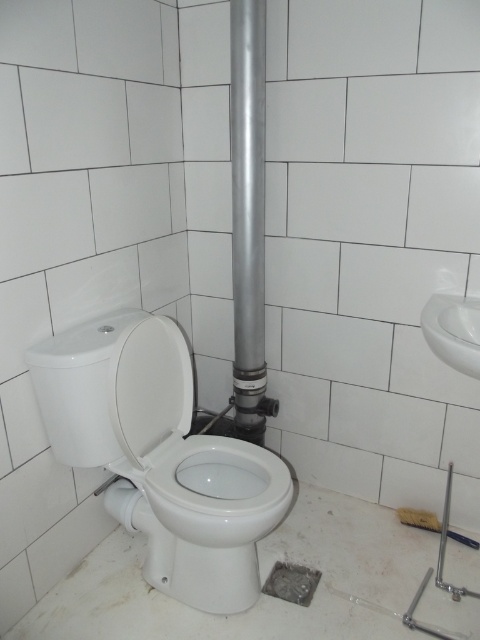
Can you confirm if white glossy toilet bowl at center is positioned below silver metallic pipe at center?

Correct, white glossy toilet bowl at center is located below silver metallic pipe at center.

Does white glossy toilet bowl at center have a smaller size compared to silver metallic pipe at center?

Indeed, white glossy toilet bowl at center has a smaller size compared to silver metallic pipe at center.

What do you see at coordinates (211, 518) in the screenshot? I see `white glossy toilet bowl at center` at bounding box center [211, 518].

Locate an element on the screen. This screenshot has width=480, height=640. white glossy toilet bowl at center is located at coordinates (211, 518).

How distant is white glossy toilet at left from white glossy toilet bowl at center?

white glossy toilet at left is 2.99 inches away from white glossy toilet bowl at center.

Is white glossy toilet at left below white glossy toilet bowl at center?

No, white glossy toilet at left is not below white glossy toilet bowl at center.

Is point (116, 451) positioned in front of point (236, 445)?

Yes, it is in front of point (236, 445).

You are a GUI agent. You are given a task and a screenshot of the screen. Output one action in this format:
    pyautogui.click(x=<x>, y=<y>)
    Task: Click on the white glossy toilet at left
    This screenshot has height=640, width=480.
    Given the screenshot: What is the action you would take?
    pyautogui.click(x=159, y=456)

Can you confirm if white glossy toilet lid at center is thinner than white glossy sink at right?

Indeed, white glossy toilet lid at center has a lesser width compared to white glossy sink at right.

Is point (110, 378) farther from viewer compared to point (472, 369)?

Yes, it is.

Between point (170, 337) and point (433, 333), which one is positioned in front?

Positioned in front is point (433, 333).

The height and width of the screenshot is (640, 480). Find the location of `white glossy toilet lid at center`. white glossy toilet lid at center is located at coordinates (149, 387).